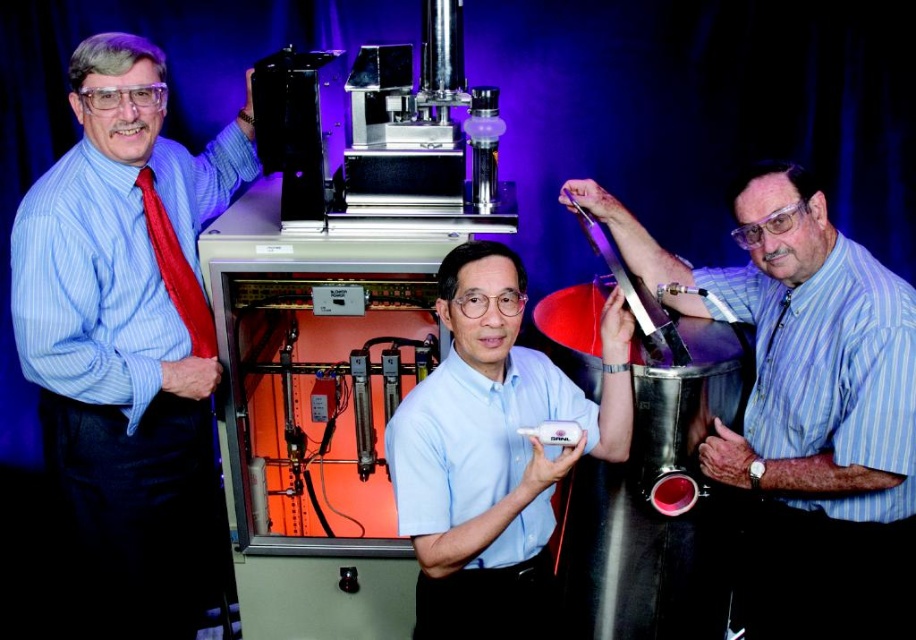
Does blue striped shirt at left appear on the right side of matte blue shirt at right?

Incorrect, blue striped shirt at left is not on the right side of matte blue shirt at right.

Is blue striped shirt at left bigger than matte blue shirt at right?

Yes, blue striped shirt at left is bigger than matte blue shirt at right.

Is point (112, 508) positioned in front of point (818, 236)?

No, (112, 508) is behind (818, 236).

This screenshot has height=640, width=916. In order to click on blue striped shirt at left in this screenshot , I will do `click(128, 337)`.

Does blue striped shirt at left have a smaller size compared to white plastic remote at center?

Incorrect, blue striped shirt at left is not smaller in size than white plastic remote at center.

Does point (75, 512) lie behind point (478, 561)?

Yes, point (75, 512) is behind point (478, 561).

Where is `blue striped shirt at left`? blue striped shirt at left is located at coordinates tap(128, 337).

The height and width of the screenshot is (640, 916). What do you see at coordinates (128, 337) in the screenshot?
I see `blue striped shirt at left` at bounding box center [128, 337].

Identify the location of blue striped shirt at left. (128, 337).